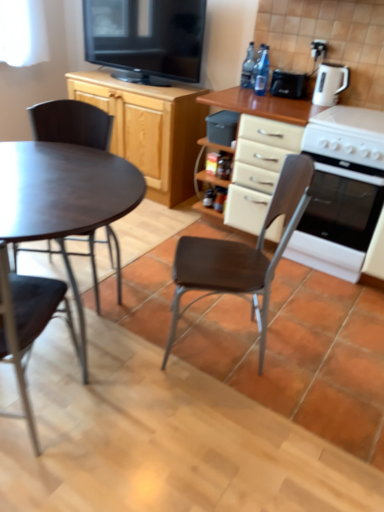
In order to click on vacant space to the right of transparent plastic bottle at upper center, the second bottle viewed from the back in this screenshot , I will do tap(287, 96).